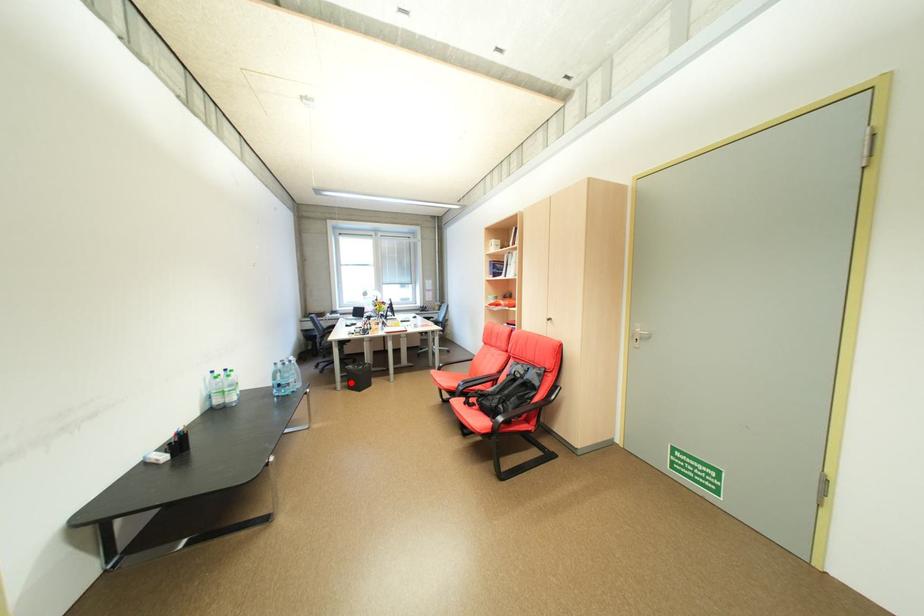
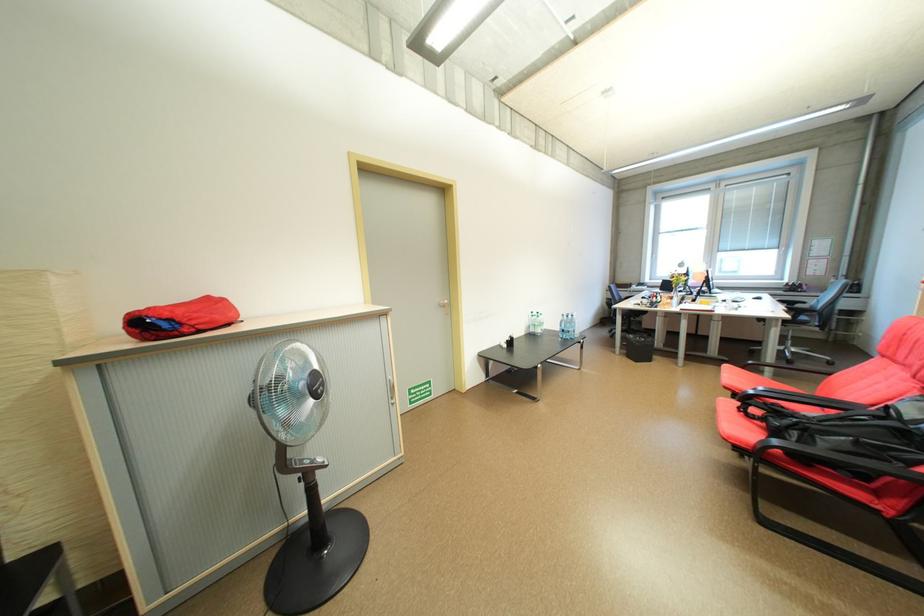
Question: I am providing you with two images of the same scene from different viewpoints. Given a red point in image1, look at the same physical point in image2. Is it:

Choices:
 (A) Closer to the viewpoint
 (B) Farther from the viewpoint

Answer: (A)